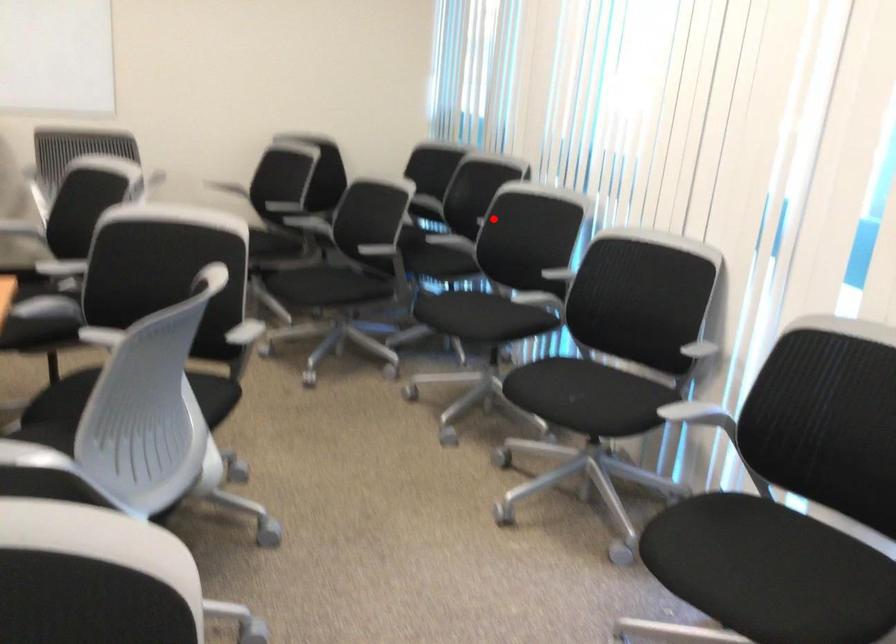
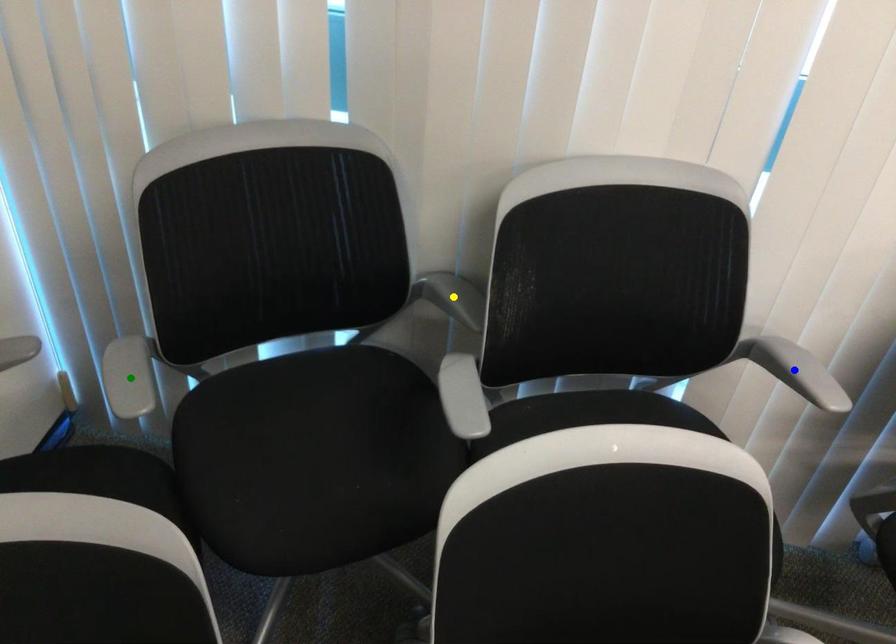
Question: I am providing you with two images of the same scene from different viewpoints. A red point is marked on the first image. You are given multiple points on the second image. Which spot in image 2 lines up with the point in image 1?

Choices:
 (A) green point
 (B) yellow point
 (C) blue point

Answer: (C)